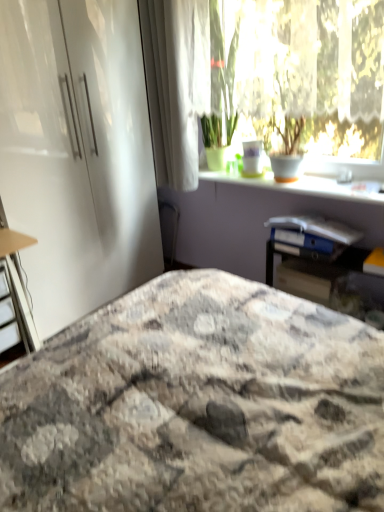
Question: Considering the relative sizes of white fabric curtain at upper left and marble-patterned bedspread at center in the image provided, is white fabric curtain at upper left thinner than marble-patterned bedspread at center?

Choices:
 (A) no
 (B) yes

Answer: (B)

Question: Does white fabric curtain at upper left turn towards marble-patterned bedspread at center?

Choices:
 (A) no
 (B) yes

Answer: (A)

Question: Does white fabric curtain at upper left lie behind marble-patterned bedspread at center?

Choices:
 (A) no
 (B) yes

Answer: (B)

Question: Can you confirm if white fabric curtain at upper left is shorter than marble-patterned bedspread at center?

Choices:
 (A) yes
 (B) no

Answer: (B)

Question: From the image's perspective, does white fabric curtain at upper left appear higher than marble-patterned bedspread at center?

Choices:
 (A) no
 (B) yes

Answer: (B)

Question: Can you confirm if white fabric curtain at upper left is smaller than marble-patterned bedspread at center?

Choices:
 (A) yes
 (B) no

Answer: (A)

Question: Is marble-patterned bedspread at center to the left of white fabric curtain at upper left from the viewer's perspective?

Choices:
 (A) no
 (B) yes

Answer: (A)

Question: Are marble-patterned bedspread at center and white fabric curtain at upper left located far from each other?

Choices:
 (A) yes
 (B) no

Answer: (A)

Question: Is white fabric curtain at upper left at the back of marble-patterned bedspread at center?

Choices:
 (A) yes
 (B) no

Answer: (B)

Question: Is white fabric curtain at upper left inside marble-patterned bedspread at center?

Choices:
 (A) yes
 (B) no

Answer: (B)

Question: From the image's perspective, is marble-patterned bedspread at center located above white fabric curtain at upper left?

Choices:
 (A) yes
 (B) no

Answer: (B)

Question: From a real-world perspective, is marble-patterned bedspread at center positioned under white fabric curtain at upper left based on gravity?

Choices:
 (A) no
 (B) yes

Answer: (B)

Question: Considering the relative sizes of white glossy window sill at upper center and transparent glass window at upper center in the image provided, is white glossy window sill at upper center smaller than transparent glass window at upper center?

Choices:
 (A) no
 (B) yes

Answer: (B)